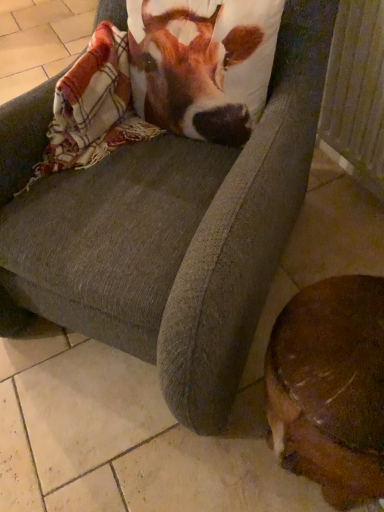
The height and width of the screenshot is (512, 384). Find the location of `wooden radiator at lower right`. wooden radiator at lower right is located at coordinates (356, 94).

This screenshot has height=512, width=384. I want to click on brown furry dog at lower right, so click(330, 388).

What are the coordinates of `plaid woolen blanket at upper left` in the screenshot? It's located at tap(92, 108).

From a real-world perspective, which is physically below, plaid woolen blanket at upper left or brown and white fabric at upper center?

plaid woolen blanket at upper left, from a real-world perspective.

Who is taller, plaid woolen blanket at upper left or brown and white fabric at upper center?

With more height is brown and white fabric at upper center.

In terms of width, does plaid woolen blanket at upper left look wider or thinner when compared to brown and white fabric at upper center?

In the image, plaid woolen blanket at upper left appears to be more narrow than brown and white fabric at upper center.

Considering the relative positions of plaid woolen blanket at upper left and brown and white fabric at upper center in the image provided, is plaid woolen blanket at upper left to the left of brown and white fabric at upper center from the viewer's perspective?

Correct, you'll find plaid woolen blanket at upper left to the left of brown and white fabric at upper center.

Based on their sizes in the image, would you say brown and white fabric at upper center is bigger or smaller than plaid woolen blanket at upper left?

brown and white fabric at upper center is bigger than plaid woolen blanket at upper left.

From the image's perspective, is brown and white fabric at upper center on top of plaid woolen blanket at upper left?

Correct, brown and white fabric at upper center appears higher than plaid woolen blanket at upper left in the image.

In the scene shown: Is brown and white fabric at upper center wider than plaid woolen blanket at upper left?

Correct, the width of brown and white fabric at upper center exceeds that of plaid woolen blanket at upper left.

Where is `cattle on the right of plaid woolen blanket at upper left`? Image resolution: width=384 pixels, height=512 pixels. cattle on the right of plaid woolen blanket at upper left is located at coordinates (x=189, y=68).

Does plaid woolen blanket at upper left have a lesser width compared to wooden radiator at lower right?

Indeed, plaid woolen blanket at upper left has a lesser width compared to wooden radiator at lower right.

Between plaid woolen blanket at upper left and wooden radiator at lower right, which one has smaller size?

plaid woolen blanket at upper left is smaller.

From the image's perspective, is plaid woolen blanket at upper left located above or below wooden radiator at lower right?

plaid woolen blanket at upper left is situated higher than wooden radiator at lower right in the image.

Between plaid woolen blanket at upper left and wooden radiator at lower right, which one has less height?

plaid woolen blanket at upper left.

Is plaid woolen blanket at upper left surrounded by brown furry dog at lower right?

That's incorrect, plaid woolen blanket at upper left is not inside brown furry dog at lower right.

Is brown furry dog at lower right oriented away from plaid woolen blanket at upper left?

brown furry dog at lower right does not have its back to plaid woolen blanket at upper left.

Which of these two, brown furry dog at lower right or plaid woolen blanket at upper left, is thinner?

plaid woolen blanket at upper left is thinner.

Does point (326, 426) appear closer or farther from the camera than point (109, 90)?

Point (326, 426) is positioned closer to the camera compared to point (109, 90).

Is wooden radiator at lower right bigger than plaid woolen blanket at upper left?

Yes.

Looking at their sizes, would you say wooden radiator at lower right is wider or thinner than plaid woolen blanket at upper left?

wooden radiator at lower right is wider than plaid woolen blanket at upper left.

Is wooden radiator at lower right looking in the opposite direction of plaid woolen blanket at upper left?

No.

Is point (351, 73) in front of point (72, 134)?

No, (351, 73) is behind (72, 134).

Identify the location of dog below the wooden radiator at lower right (from a real-world perspective). The width and height of the screenshot is (384, 512). (330, 388).

Does brown furry dog at lower right have a greater height compared to wooden radiator at lower right?

No, brown furry dog at lower right is not taller than wooden radiator at lower right.

Is brown furry dog at lower right next to wooden radiator at lower right and touching it?

No, brown furry dog at lower right is not next to wooden radiator at lower right.

Is brown furry dog at lower right inside the boundaries of wooden radiator at lower right, or outside?

brown furry dog at lower right is not enclosed by wooden radiator at lower right.

Does wooden radiator at lower right have a smaller size compared to brown and white fabric at upper center?

No, wooden radiator at lower right is not smaller than brown and white fabric at upper center.

Measure the distance from wooden radiator at lower right to brown and white fabric at upper center.

wooden radiator at lower right is 15.19 inches away from brown and white fabric at upper center.

Choose the correct answer: Is wooden radiator at lower right inside brown and white fabric at upper center or outside it?

wooden radiator at lower right is located beyond the bounds of brown and white fabric at upper center.

From the picture: Is wooden radiator at lower right at the left side of brown and white fabric at upper center?

No, wooden radiator at lower right is not to the left of brown and white fabric at upper center.

The image size is (384, 512). Find the location of `cattle above the plaid woolen blanket at upper left (from the image's perspective)`. cattle above the plaid woolen blanket at upper left (from the image's perspective) is located at coordinates coord(189,68).

This screenshot has width=384, height=512. I want to click on blanket that appears below the brown and white fabric at upper center (from the image's perspective), so click(92, 108).

From the image, which object appears to be nearer to wooden radiator at lower right, brown furry dog at lower right or plaid woolen blanket at upper left?

plaid woolen blanket at upper left.

Estimate the real-world distances between objects in this image. Which object is closer to plaid woolen blanket at upper left, wooden radiator at lower right or brown and white fabric at upper center?

brown and white fabric at upper center is closer to plaid woolen blanket at upper left.

From the image, which object appears to be nearer to brown and white fabric at upper center, plaid woolen blanket at upper left or brown furry dog at lower right?

Based on the image, plaid woolen blanket at upper left appears to be nearer to brown and white fabric at upper center.

From the image, which object appears to be farther from plaid woolen blanket at upper left, brown and white fabric at upper center or brown furry dog at lower right?

Among the two, brown furry dog at lower right is located further to plaid woolen blanket at upper left.

From the image, which object appears to be farther from wooden radiator at lower right, brown and white fabric at upper center or brown furry dog at lower right?

brown furry dog at lower right is further to wooden radiator at lower right.

When comparing their distances from plaid woolen blanket at upper left, does brown furry dog at lower right or wooden radiator at lower right seem closer?

Based on the image, wooden radiator at lower right appears to be nearer to plaid woolen blanket at upper left.

Which object lies nearer to the anchor point plaid woolen blanket at upper left, brown furry dog at lower right or brown and white fabric at upper center?

Among the two, brown and white fabric at upper center is located nearer to plaid woolen blanket at upper left.

When comparing their distances from brown furry dog at lower right, does plaid woolen blanket at upper left or wooden radiator at lower right seem closer?

The object closer to brown furry dog at lower right is plaid woolen blanket at upper left.

The image size is (384, 512). I want to click on radiator between plaid woolen blanket at upper left and brown furry dog at lower right in the vertical direction, so click(356, 94).

Where is `radiator between brown and white fabric at upper center and brown furry dog at lower right vertically`? The height and width of the screenshot is (512, 384). radiator between brown and white fabric at upper center and brown furry dog at lower right vertically is located at coordinates (356, 94).

Where is `blanket between brown and white fabric at upper center and brown furry dog at lower right in the up-down direction`? The image size is (384, 512). blanket between brown and white fabric at upper center and brown furry dog at lower right in the up-down direction is located at coordinates (92, 108).

Locate an element on the screen. The height and width of the screenshot is (512, 384). cattle between plaid woolen blanket at upper left and wooden radiator at lower right from left to right is located at coordinates (189, 68).